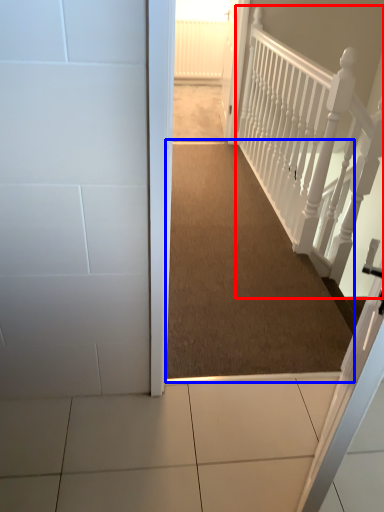
Question: Which object appears farthest to the camera in this image, rail (highlighted by a red box) or corridor (highlighted by a blue box)?

Choices:
 (A) rail
 (B) corridor

Answer: (B)